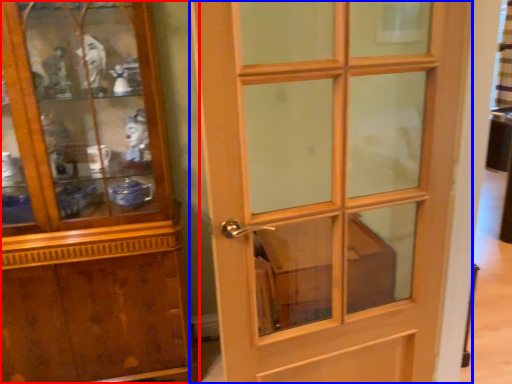
Question: Which of the following is the farthest to the observer, cupboard (highlighted by a red box) or door (highlighted by a blue box)?

Choices:
 (A) cupboard
 (B) door

Answer: (A)